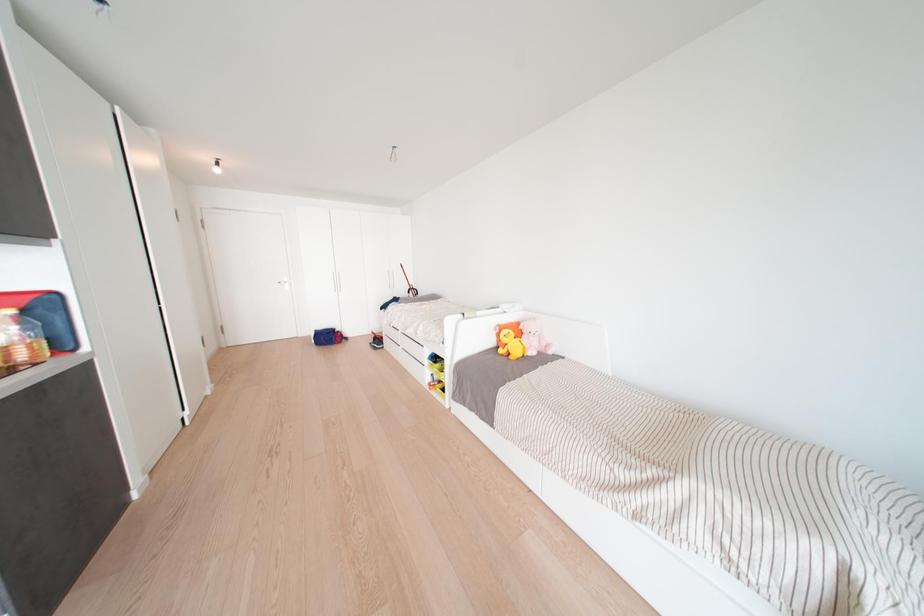
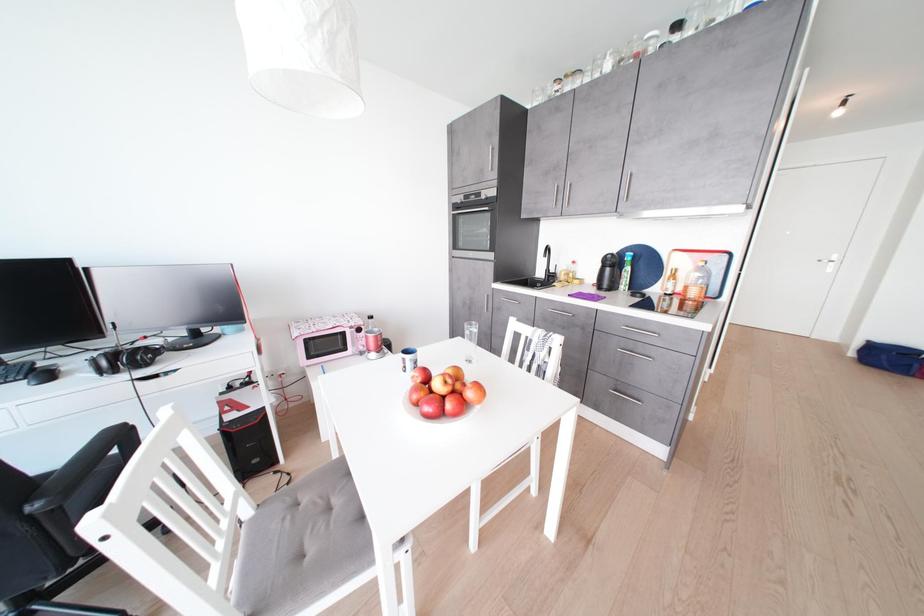
How did the camera likely rotate?

The rotation direction of the camera is left-down.